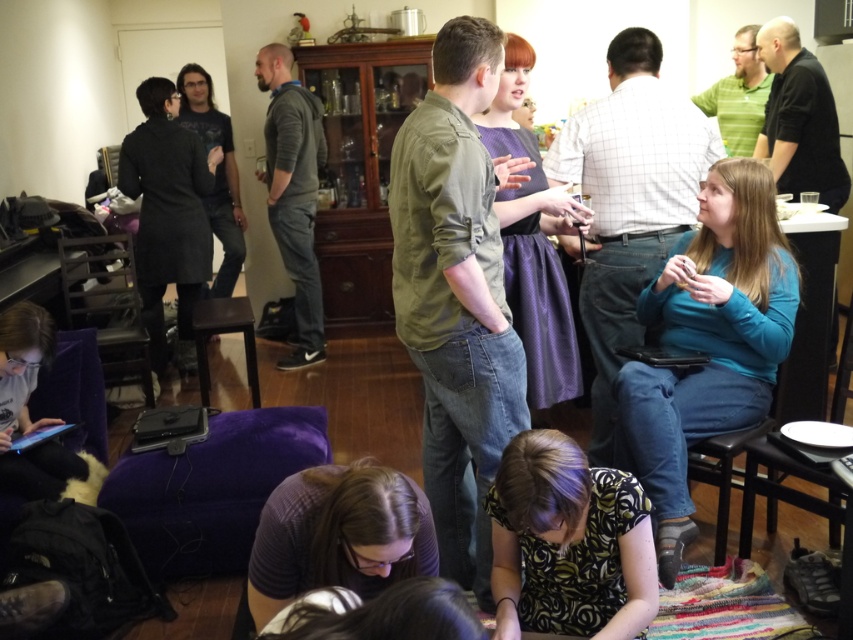
You are a photographer trying to capture a candid shot of the green textured shirt at center without being noticed. You have a camera that has a maximum focus range of 7 feet. Can you take the photo from your current position?

The green textured shirt at center and camera are 8.00 feet apart, which exceeds the camera maximum focus range of 7 feet. Therefore, you cannot take the photo from your current position.

You are a guest at this gathering and want to sit down. You see the green textured shirt at center and the black plastic stool at lower right. Which object is closer to the floor?

The black plastic stool at lower right is closer to the floor since it is a stool, and the green textured shirt at center is located above it.